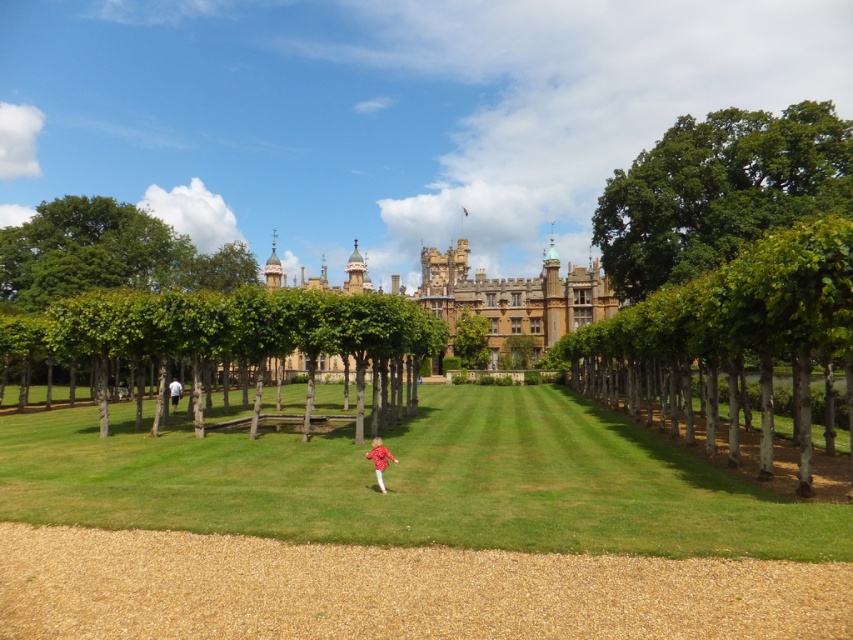
You are standing at the origin point of the coordinate system, which is the bottom left corner of the image. The image has a coordinate system where the bottom left corner is the origin point. You want to walk towards the green grass at center. According to the coordinate system, in which direction should you move first? Please answer with either up, down, right, or left.

The green grass at center is located at coordinate point (416, 483). Since the origin is at the bottom left corner, moving towards higher x values means moving to the right, and higher y values mean moving up. To reach the green grass at center from the origin, you need to move both right and up. However, since the question asks for the first direction, you should move right first because the x coordinate is 0.755, which is further from the origin than the y coordinate of 0.489. Wait, actually, the first

From the picture: You are a photographer standing on the lawn and want to take a photo that includes both the green leafy trees at center and the white cotton shirt at left. Which object should you focus on first if you want the larger one to be in sharp focus?

The green leafy trees at center are larger than the white cotton shirt at left, so you should focus on the green leafy trees at center first to ensure they are in sharp focus.